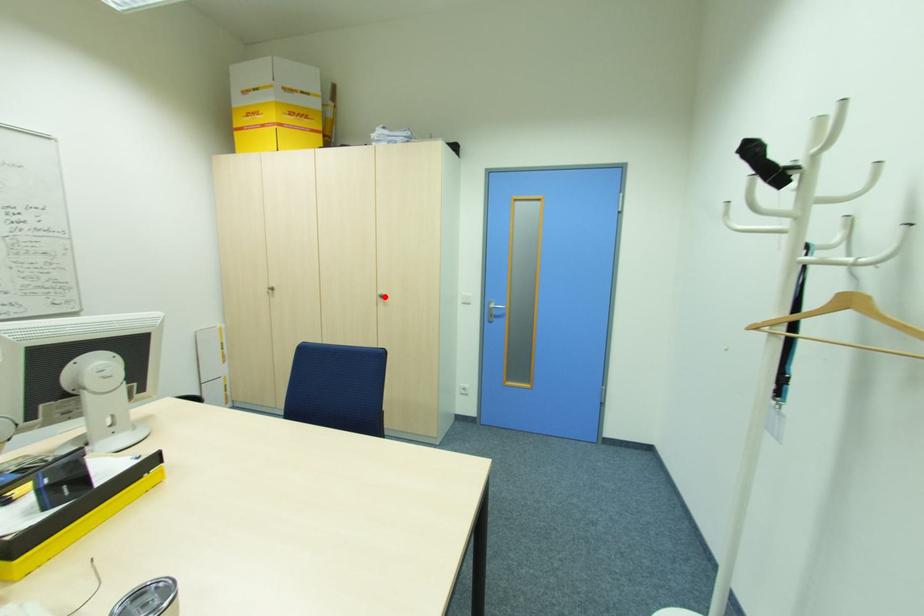
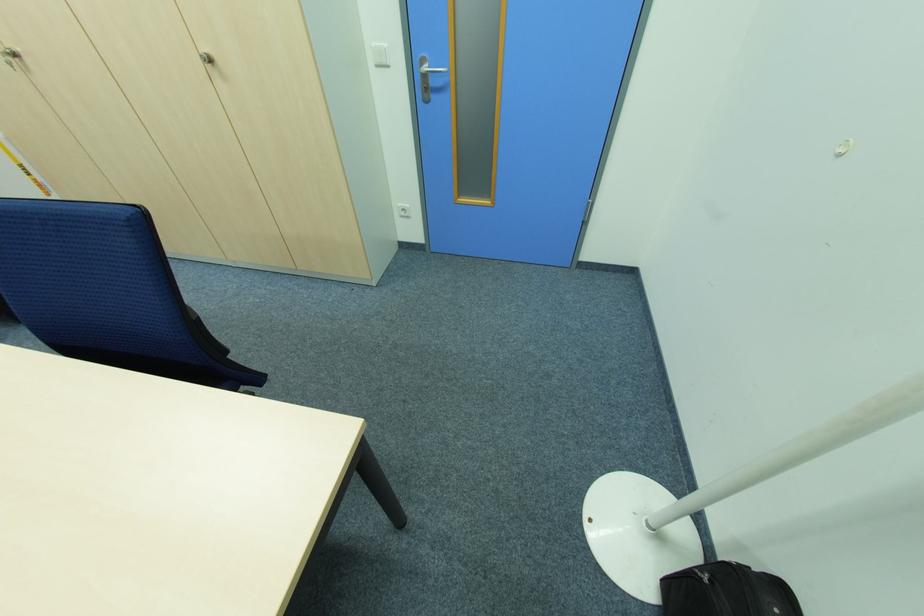
In the second image, find the point that corresponds to the highlighted location in the first image.

(213, 62)